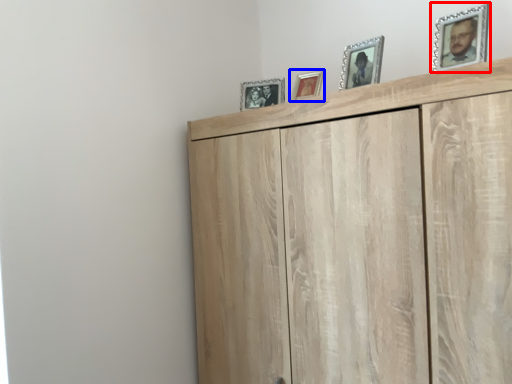
Question: Which object is further to the camera taking this photo, picture frame (highlighted by a red box) or picture frame (highlighted by a blue box)?

Choices:
 (A) picture frame
 (B) picture frame

Answer: (B)